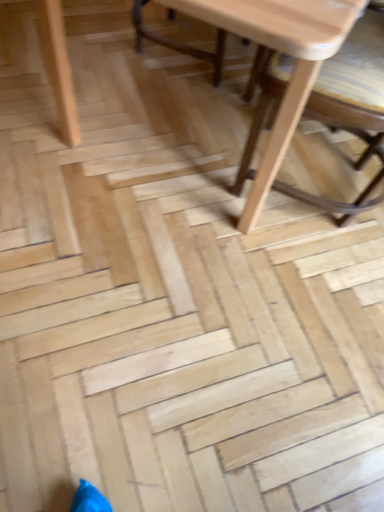
What do you see at coordinates (351, 105) in the screenshot? I see `light wood chair at upper right` at bounding box center [351, 105].

You are a GUI agent. You are given a task and a screenshot of the screen. Output one action in this format:
    pyautogui.click(x=<x>, y=<y>)
    Task: Click on the light wood chair at upper right
    The height and width of the screenshot is (512, 384).
    Given the screenshot: What is the action you would take?
    pyautogui.click(x=351, y=105)

Locate an element on the screen. light wood chair at upper right is located at coordinates (351, 105).